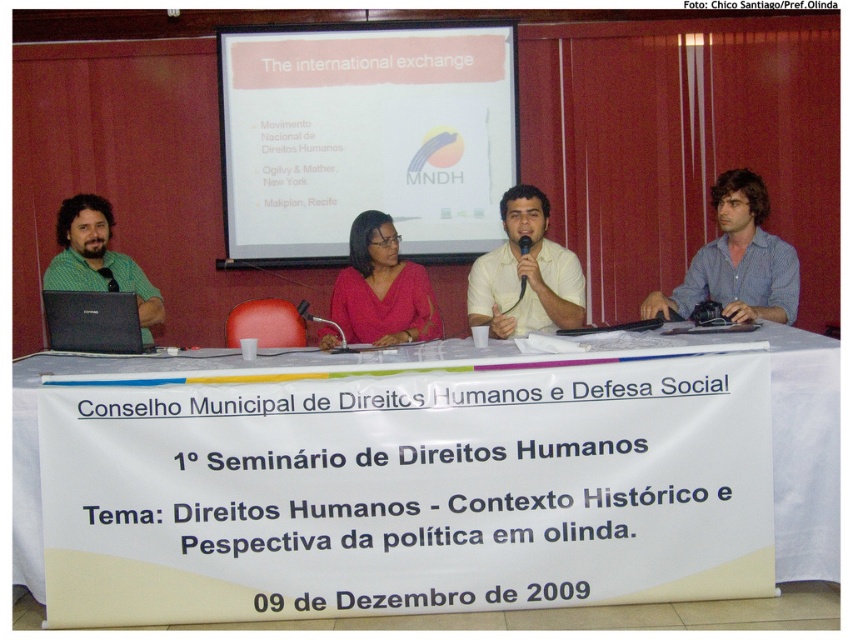
Question: Among these objects, which one is farthest from the camera?

Choices:
 (A) black plastic microphone at upper center
 (B) matte pink blouse at center
 (C) white paper at center

Answer: (A)

Question: Which of the following is the farthest from the observer?

Choices:
 (A) (131, 301)
 (B) (418, 326)
 (C) (737, 218)
 (D) (519, 296)

Answer: (C)

Question: Which is nearer to the green matte shirt at left?

Choices:
 (A) black plastic microphone at center
 (B) white matte projector screen at upper center
 (C) blue striped shirt at right

Answer: (B)

Question: Does blue striped shirt at right come behind black plastic microphone at center?

Choices:
 (A) yes
 (B) no

Answer: (B)

Question: From the image, what is the correct spatial relationship of blue striped shirt at right in relation to black matte laptop at left?

Choices:
 (A) right
 (B) left

Answer: (A)

Question: Can you confirm if white matte projector screen at upper center is positioned to the right of white shirt at center?

Choices:
 (A) yes
 (B) no

Answer: (B)